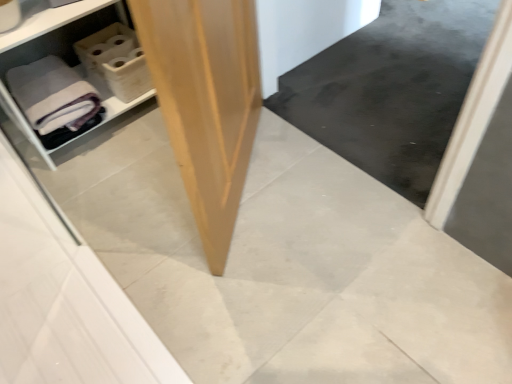
Question: From a real-world perspective, is white plastic shelf at left positioned above or below light brown plywood at center?

Choices:
 (A) below
 (B) above

Answer: (A)

Question: From the image's perspective, is white plastic shelf at left above or below light brown plywood at center?

Choices:
 (A) below
 (B) above

Answer: (B)

Question: Which is farther from the gray matte bath towel at left?

Choices:
 (A) white plastic shelf at left
 (B) light brown plywood at center

Answer: (B)

Question: Which object is the farthest from the white plastic shelf at left?

Choices:
 (A) light brown plywood at center
 (B) gray matte bath towel at left

Answer: (A)